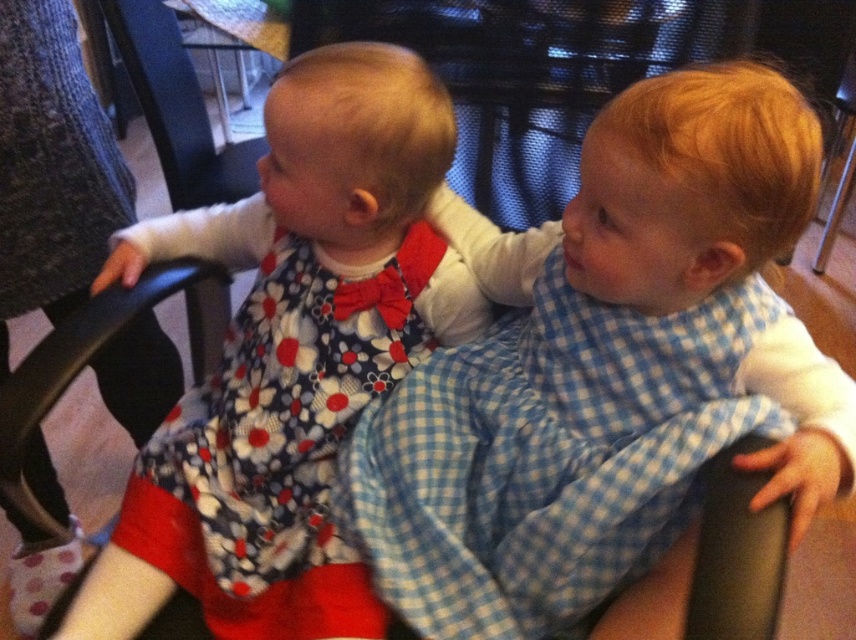
Question: From the image, what is the correct spatial relationship of blue checkered bib at center in relation to floral fabric dress at left?

Choices:
 (A) below
 (B) above

Answer: (B)

Question: Is blue checkered bib at center to the right of floral fabric dress at left from the viewer's perspective?

Choices:
 (A) no
 (B) yes

Answer: (B)

Question: Which point is farther from the camera taking this photo?

Choices:
 (A) (459, 417)
 (B) (403, 49)

Answer: (B)

Question: Among these points, which one is farthest from the camera?

Choices:
 (A) (590, 596)
 (B) (162, 259)

Answer: (B)

Question: Is the position of blue checkered bib at center less distant than that of floral fabric dress at left?

Choices:
 (A) no
 (B) yes

Answer: (B)